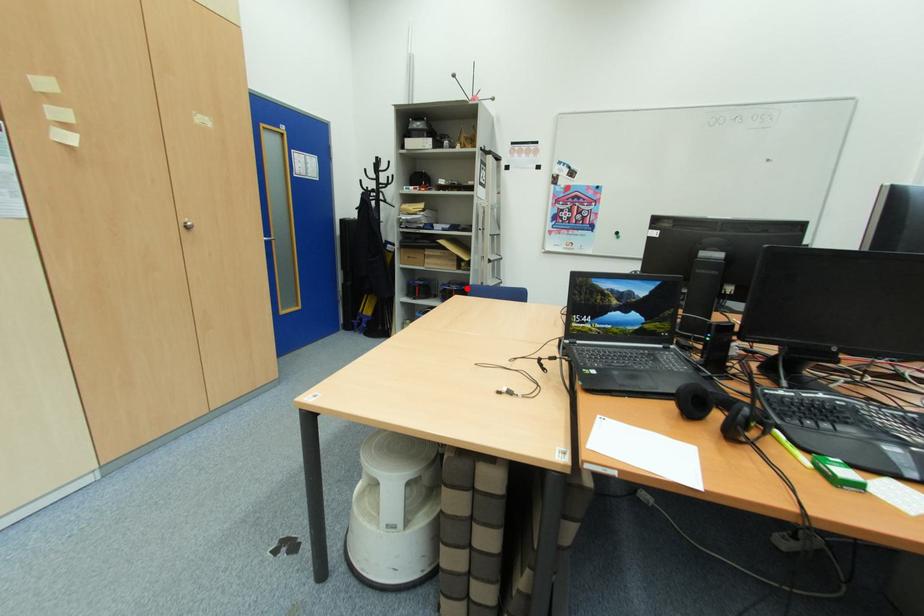
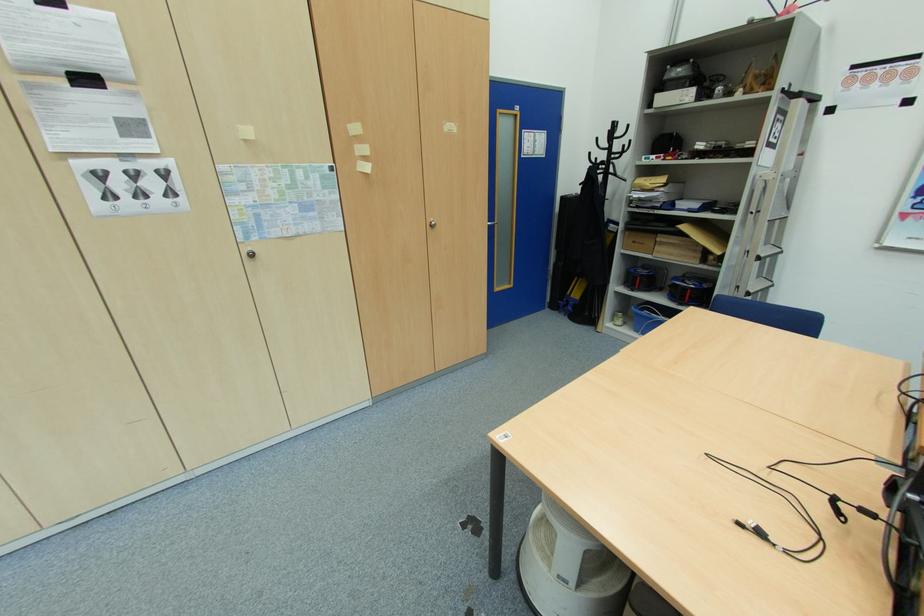
In the second image, find the point that corresponds to the highlighted location in the first image.

(709, 286)